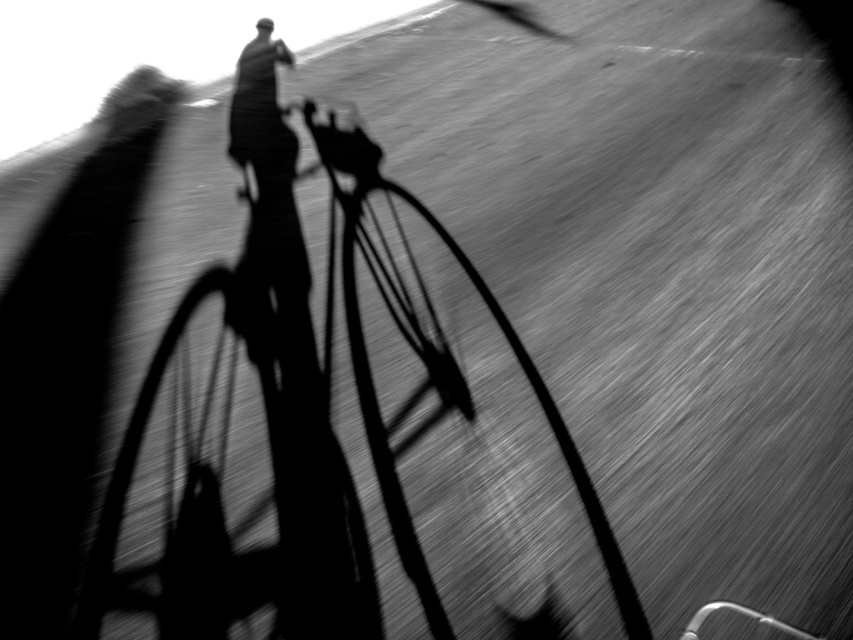
Question: Can you confirm if silhouette metal bicycle at center is thinner than smooth metal bicycle wheel at center?

Choices:
 (A) yes
 (B) no

Answer: (B)

Question: Which object is farther from the camera taking this photo?

Choices:
 (A) smooth black wheel at center
 (B) smooth metal bicycle wheel at center
 (C) silhouette metal bicycle at center

Answer: (B)

Question: Is silhouette metal bicycle at center above smooth metal bicycle wheel at center?

Choices:
 (A) no
 (B) yes

Answer: (B)

Question: Can you confirm if silhouette metal bicycle at center is positioned above smooth metal bicycle wheel at center?

Choices:
 (A) no
 (B) yes

Answer: (B)

Question: Which point is farther to the camera?

Choices:
 (A) (512, 339)
 (B) (148, 428)
 (C) (332, 568)

Answer: (A)

Question: Estimate the real-world distances between objects in this image. Which object is farther from the smooth metal bicycle wheel at center?

Choices:
 (A) smooth black wheel at center
 (B) silhouette metal bicycle at center

Answer: (A)